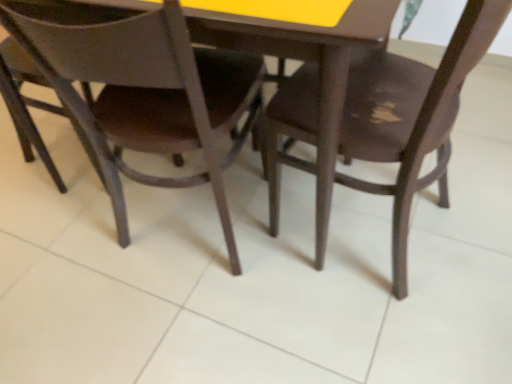
Question: From a real-world perspective, is matte brown chair at center, the 2th chair when ordered from right to left, physically located above or below dark wood chair at center, the 1th chair in the right-to-left sequence?

Choices:
 (A) below
 (B) above

Answer: (B)

Question: Is matte brown chair at center, the 2th chair when ordered from right to left, bigger or smaller than dark wood chair at center, which is the 2th chair from left to right?

Choices:
 (A) small
 (B) big

Answer: (A)

Question: From the image's perspective, relative to dark wood chair at center, the 1th chair in the right-to-left sequence, is matte brown chair at center, the 2th chair when ordered from right to left, above or below?

Choices:
 (A) below
 (B) above

Answer: (B)

Question: From the image's perspective, is dark wood chair at center, which is the 2th chair from left to right, located above or below matte brown chair at center, the 1th chair positioned from the left?

Choices:
 (A) below
 (B) above

Answer: (A)

Question: From a real-world perspective, is dark wood chair at center, the 1th chair in the right-to-left sequence, positioned above or below matte brown chair at center, the 1th chair positioned from the left?

Choices:
 (A) above
 (B) below

Answer: (B)

Question: In the image, is dark wood chair at center, which is the 2th chair from left to right, positioned in front of or behind matte brown chair at center, the 2th chair when ordered from right to left?

Choices:
 (A) behind
 (B) front

Answer: (B)

Question: Choose the correct answer: Is dark wood chair at center, which is the 2th chair from left to right, inside matte brown chair at center, the 1th chair positioned from the left, or outside it?

Choices:
 (A) inside
 (B) outside

Answer: (B)